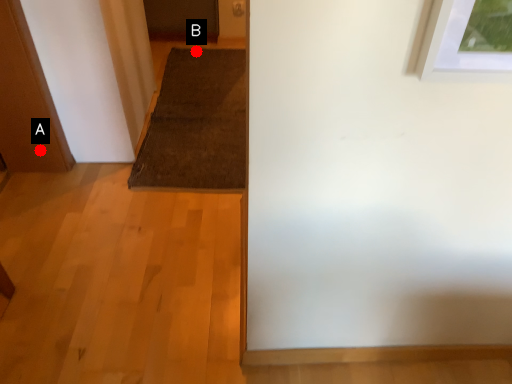
Question: Two points are circled on the image, labeled by A and B beside each circle. Which point appears closest to the camera in this image?

Choices:
 (A) A is closer
 (B) B is closer

Answer: (A)